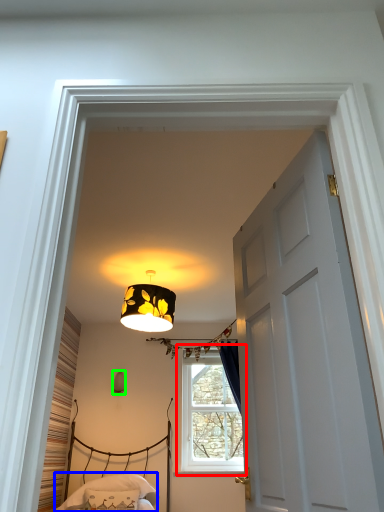
Question: Which is farther away from window (highlighted by a red box)? bedding (highlighted by a blue box) or lamp (highlighted by a green box)?

Choices:
 (A) bedding
 (B) lamp

Answer: (B)